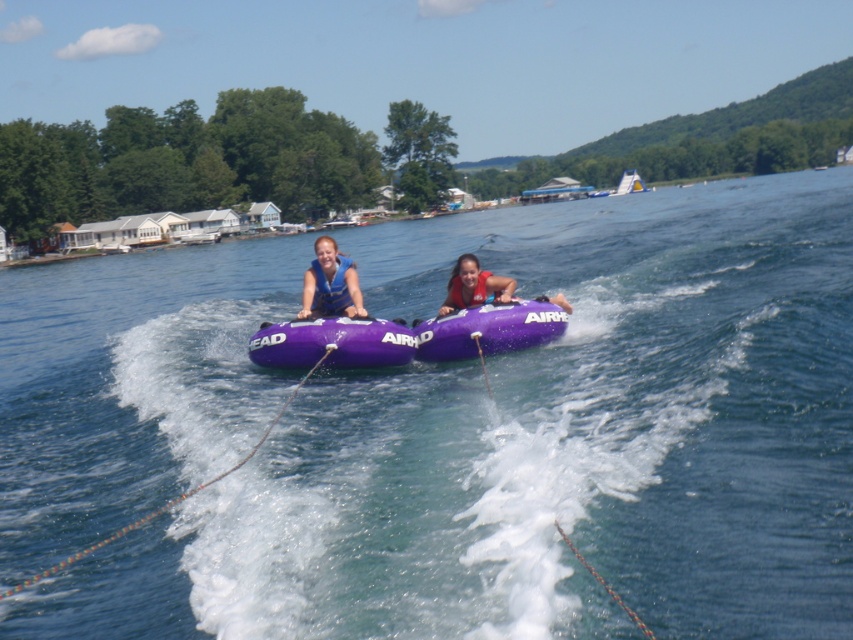
Question: Among these points, which one is nearest to the camera?

Choices:
 (A) (331, 308)
 (B) (479, 273)

Answer: (A)

Question: Considering the real-world distances, which object is farthest from the purple rubber tubes at center?

Choices:
 (A) matte blue life vest at center
 (B) purple fabric life jacket at center
 (C) purple rubber tube at center
 (D) purple inflatable tube at center

Answer: (A)

Question: Which object is closer to the camera taking this photo?

Choices:
 (A) purple fabric life jacket at center
 (B) purple inflatable tube at center

Answer: (B)

Question: Is matte blue life vest at center above purple rubber tube at center?

Choices:
 (A) no
 (B) yes

Answer: (B)

Question: Can you confirm if purple inflatable tube at center is wider than purple rubber tube at center?

Choices:
 (A) no
 (B) yes

Answer: (B)

Question: Can you confirm if purple rubber tubes at center is smaller than purple rubber tube at center?

Choices:
 (A) no
 (B) yes

Answer: (A)